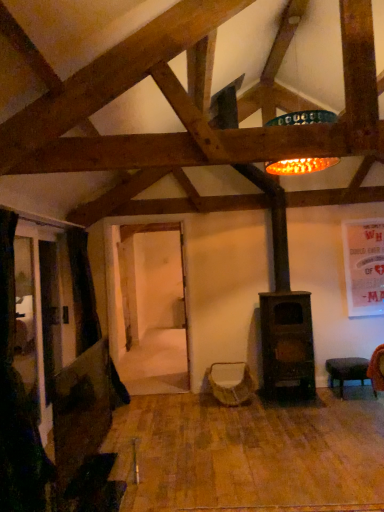
Question: Does woven fabric swivel chair at center appear on the right side of black fabric curtain at left?

Choices:
 (A) no
 (B) yes

Answer: (B)

Question: Is woven fabric swivel chair at center in front of black fabric curtain at left?

Choices:
 (A) yes
 (B) no

Answer: (B)

Question: Can you confirm if woven fabric swivel chair at center is shorter than black fabric curtain at left?

Choices:
 (A) yes
 (B) no

Answer: (A)

Question: Is woven fabric swivel chair at center positioned beyond the bounds of black fabric curtain at left?

Choices:
 (A) no
 (B) yes

Answer: (B)

Question: Does woven fabric swivel chair at center have a greater height compared to black fabric curtain at left?

Choices:
 (A) no
 (B) yes

Answer: (A)

Question: From a real-world perspective, relative to woven fabric swivel chair at center, is black leather stool at lower right vertically above or below?

Choices:
 (A) below
 (B) above

Answer: (A)

Question: Does point (354, 373) appear closer or farther from the camera than point (211, 372)?

Choices:
 (A) farther
 (B) closer

Answer: (B)

Question: Based on their sizes in the image, would you say black leather stool at lower right is bigger or smaller than woven fabric swivel chair at center?

Choices:
 (A) big
 (B) small

Answer: (B)

Question: Considering the positions of black leather stool at lower right and woven fabric swivel chair at center in the image, is black leather stool at lower right taller or shorter than woven fabric swivel chair at center?

Choices:
 (A) tall
 (B) short

Answer: (B)

Question: From a real-world perspective, is black fabric curtain at left above or below woven fabric swivel chair at center?

Choices:
 (A) above
 (B) below

Answer: (A)

Question: From their relative heights in the image, would you say black fabric curtain at left is taller or shorter than woven fabric swivel chair at center?

Choices:
 (A) short
 (B) tall

Answer: (B)

Question: Does point (4, 351) appear closer or farther from the camera than point (249, 393)?

Choices:
 (A) farther
 (B) closer

Answer: (B)

Question: From the image's perspective, relative to woven fabric swivel chair at center, is black fabric curtain at left above or below?

Choices:
 (A) above
 (B) below

Answer: (A)

Question: In terms of width, does woven fabric swivel chair at center look wider or thinner when compared to black fabric curtain at left?

Choices:
 (A) wide
 (B) thin

Answer: (A)

Question: From the image's perspective, is woven fabric swivel chair at center above or below black fabric curtain at left?

Choices:
 (A) below
 (B) above

Answer: (A)